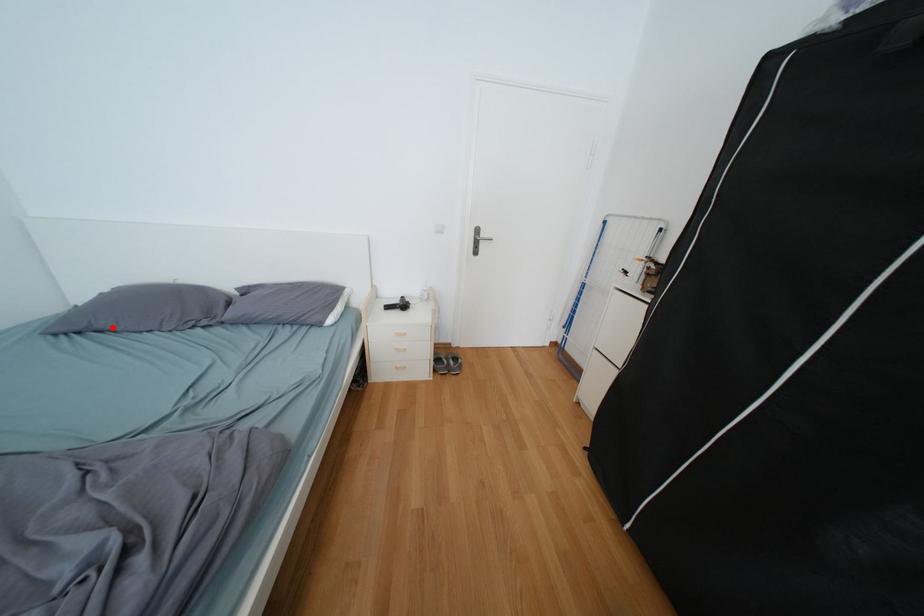
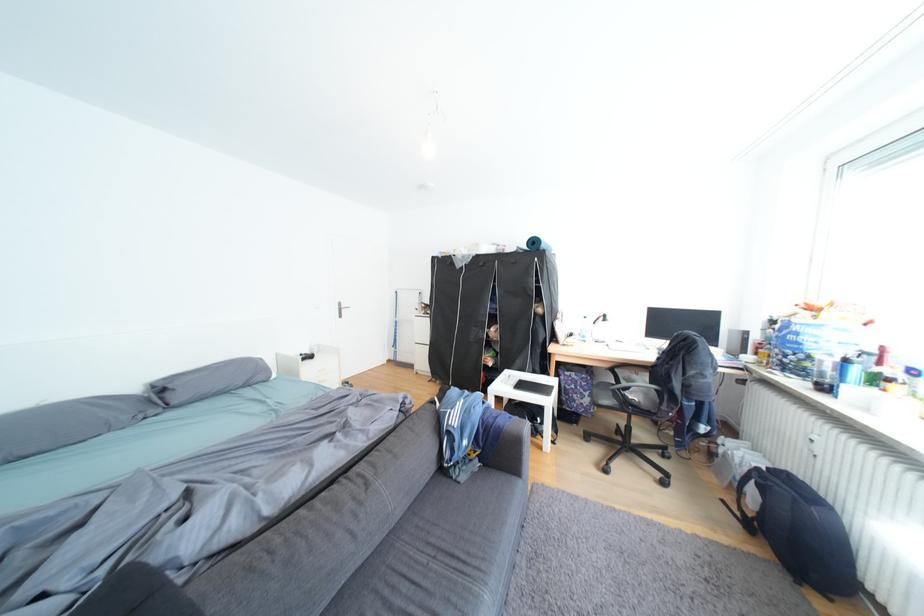
Where in the second image is the point corresponding to the highlighted location from the first image?

(40, 453)